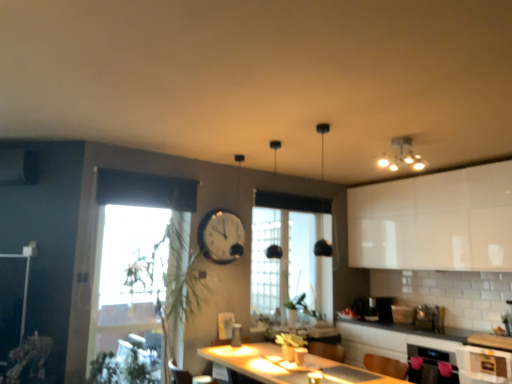
Question: From a real-world perspective, is clear glass window at center, the 1th window positioned from the back, physically below green leafy plant at lower left?

Choices:
 (A) yes
 (B) no

Answer: (B)

Question: Does clear glass window at center, which is the 1th window from right to left, come behind green leafy plant at lower left?

Choices:
 (A) yes
 (B) no

Answer: (A)

Question: Considering the relative sizes of clear glass window at center, which ranks as the second window in left-to-right order, and green leafy plant at lower left in the image provided, is clear glass window at center, which ranks as the second window in left-to-right order, taller than green leafy plant at lower left?

Choices:
 (A) no
 (B) yes

Answer: (B)

Question: Considering the relative sizes of clear glass window at center, marked as the 2th window in a front-to-back arrangement, and green leafy plant at lower left in the image provided, is clear glass window at center, marked as the 2th window in a front-to-back arrangement, wider than green leafy plant at lower left?

Choices:
 (A) yes
 (B) no

Answer: (B)

Question: Can you confirm if clear glass window at center, the 1th window positioned from the back, is positioned to the right of green leafy plant at lower left?

Choices:
 (A) yes
 (B) no

Answer: (A)

Question: Is clear glass window at center, the 1th window positioned from the back, completely or partially outside of green leafy plant at lower left?

Choices:
 (A) yes
 (B) no

Answer: (A)

Question: Can you confirm if green leafy plant at lower left is thinner than clear glass window at center, which is the 1th window from right to left?

Choices:
 (A) yes
 (B) no

Answer: (B)

Question: Is green leafy plant at lower left at the left side of clear glass window at center, which ranks as the second window in left-to-right order?

Choices:
 (A) no
 (B) yes

Answer: (B)

Question: Does green leafy plant at lower left have a greater height compared to clear glass window at center, the 1th window positioned from the back?

Choices:
 (A) no
 (B) yes

Answer: (A)

Question: Considering the relative sizes of green leafy plant at lower left and clear glass window at center, the 1th window positioned from the back, in the image provided, is green leafy plant at lower left wider than clear glass window at center, the 1th window positioned from the back,?

Choices:
 (A) yes
 (B) no

Answer: (A)

Question: Are green leafy plant at lower left and clear glass window at center, marked as the 2th window in a front-to-back arrangement, making contact?

Choices:
 (A) yes
 (B) no

Answer: (B)

Question: Is the position of green leafy plant at lower left less distant than that of clear glass window at center, which ranks as the second window in left-to-right order?

Choices:
 (A) yes
 (B) no

Answer: (A)

Question: Is clear glass window at center, marked as the 2th window in a front-to-back arrangement, positioned far away from transparent glass window at left, which is counted as the 1th window, starting from the front?

Choices:
 (A) yes
 (B) no

Answer: (A)